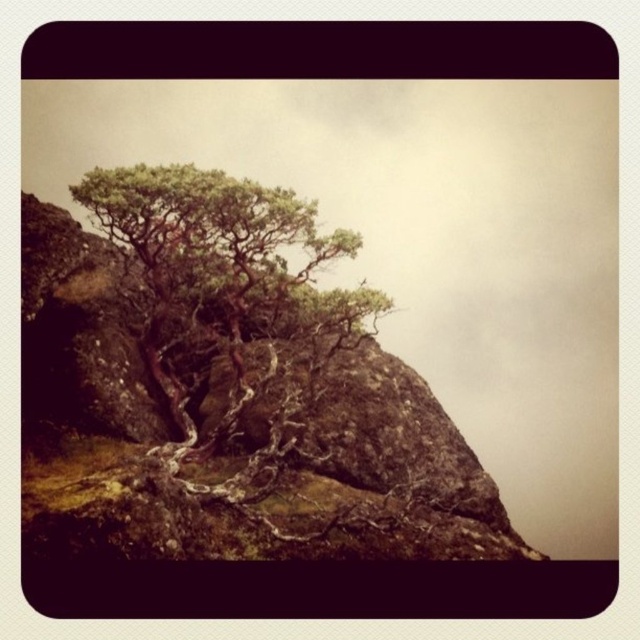
You are standing at the base of the cliff and want to reach the highest point on the cliff. Which point, point [152,397] or point [148,276], is closer to you and might be a better starting point for your climb?

Point [152,397] is closer to the viewer than point [148,276], so it might be a better starting point for your climb since it is nearer to your current position at the base of the cliff.

You are a hiker trying to navigate between the green mossy rock at upper center and the green textured tree at center. If your backpack has a 7 feet long rope, will it be sufficient to bridge the gap between them?

The green mossy rock at upper center is 6.91 feet away from the green textured tree at center. Since the rope is 7 feet long, it will be sufficient to bridge the gap between them.

You are a hiker who wants to climb the cliff. You see the green mossy rock at upper center and the green textured tree at center. Which one is taller?

The green mossy rock at upper center is taller than the green textured tree at center.